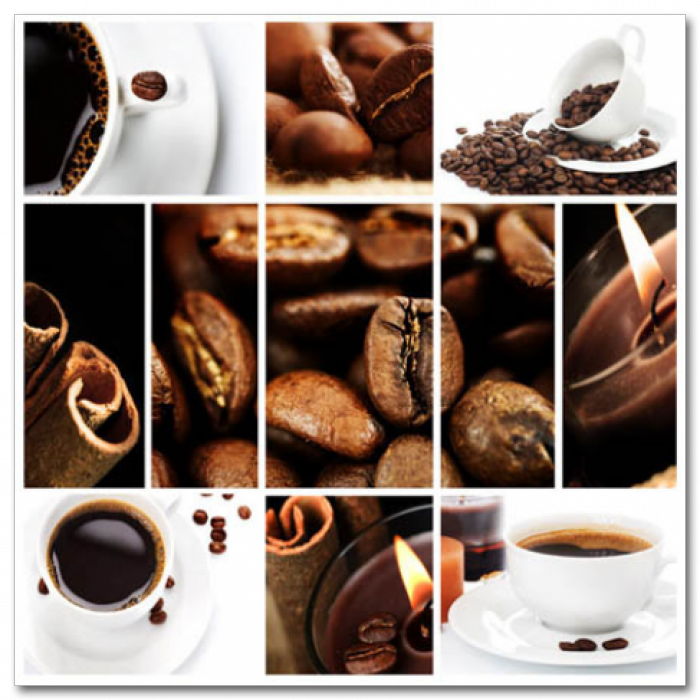
At what (x,y) coordinates should I click in order to perform the action: click on cups. Please return your answer as a coordinate pair (x, y). Image resolution: width=700 pixels, height=700 pixels. Looking at the image, I should click on (153, 556), (566, 595), (575, 113), (131, 85).